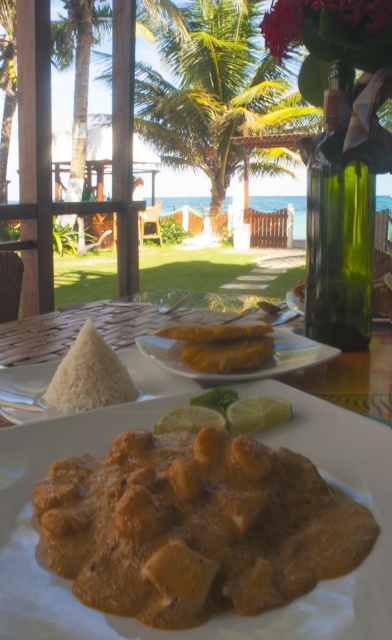
Which of these two, smooth creamy curry at center or green glass bottle at right, stands shorter?

Standing shorter between the two is smooth creamy curry at center.

Which is below, smooth creamy curry at center or green glass bottle at right?

smooth creamy curry at center is lower down.

Is point (94, 499) positioned after point (348, 186)?

No, it is not.

Locate an element on the screen. smooth creamy curry at center is located at coordinates (196, 525).

Can you confirm if white matte rice at lower left is shorter than white matte rice at center?

Incorrect, white matte rice at lower left's height does not fall short of white matte rice at center's.

Can you confirm if white matte rice at lower left is positioned below white matte rice at center?

No.

Between point (150, 326) and point (98, 332), which one is positioned behind?

Positioned behind is point (150, 326).

This screenshot has width=392, height=640. What are the coordinates of `white matte rice at lower left` in the screenshot? It's located at (79, 328).

Is white matte rice at lower left below yellow matte plate at center?

Actually, white matte rice at lower left is above yellow matte plate at center.

Which is above, white matte rice at lower left or yellow matte plate at center?

white matte rice at lower left

Does point (32, 362) come in front of point (197, 376)?

No, it is behind (197, 376).

This screenshot has height=640, width=392. Find the location of `white matte rice at lower left`. white matte rice at lower left is located at coordinates (79, 328).